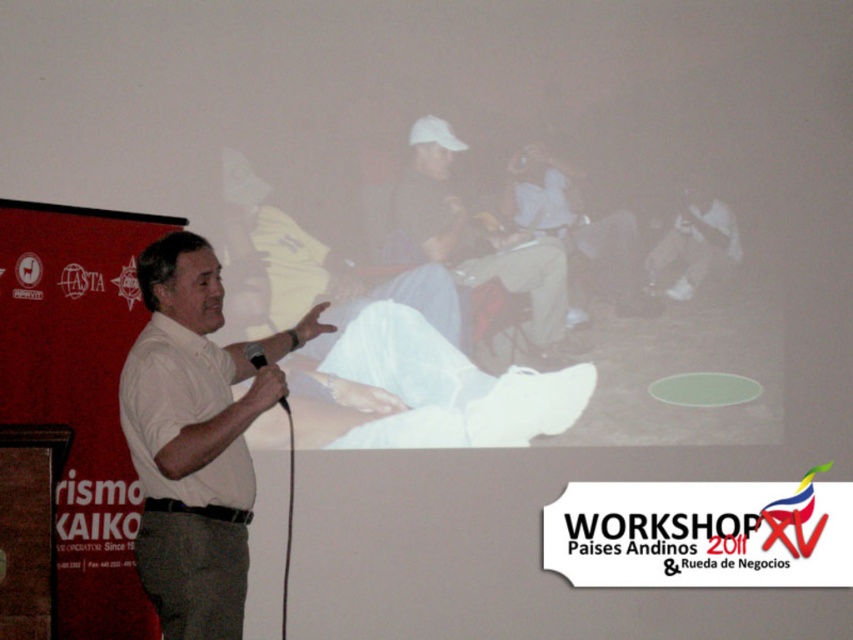
Question: Is matte white shirt at center closer to the viewer compared to matte black shirt at center?

Choices:
 (A) no
 (B) yes

Answer: (B)

Question: Can you confirm if matte black shirt at center is bigger than light beige pants at center?

Choices:
 (A) yes
 (B) no

Answer: (A)

Question: Which point is closer to the camera?

Choices:
 (A) (180, 496)
 (B) (231, 148)

Answer: (A)

Question: Is white shirt at center to the right of matte white shirt at center from the viewer's perspective?

Choices:
 (A) yes
 (B) no

Answer: (B)

Question: Which object appears closest to the camera in this image?

Choices:
 (A) white matte shirt at center
 (B) matte white shirt at center
 (C) matte black shirt at center
 (D) white shirt at center

Answer: (D)

Question: Estimate the real-world distances between objects in this image. Which object is farther from the black matte microphone at center?

Choices:
 (A) white matte shirt at center
 (B) light beige pants at center
 (C) matte black shirt at center
 (D) matte white shirt at center

Answer: (A)